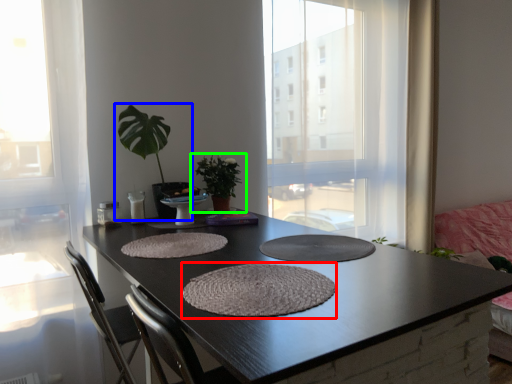
Question: Based on their relative distances, which object is farther from wide (highlighted by a red box)? Choose from houseplant (highlighted by a blue box) and houseplant (highlighted by a green box).

Choices:
 (A) houseplant
 (B) houseplant

Answer: (B)